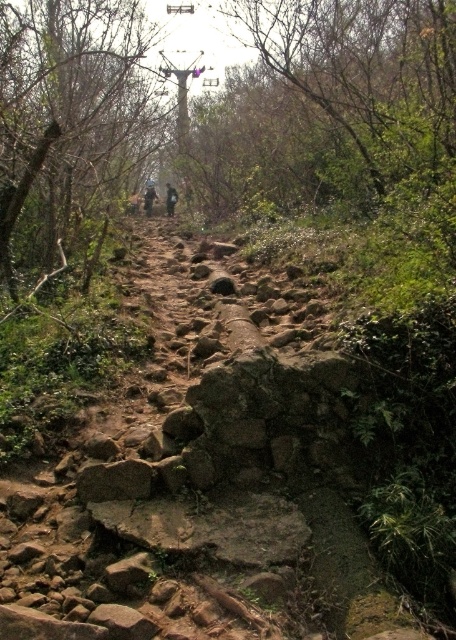
Question: Which point is closer to the camera?

Choices:
 (A) (171, 188)
 (B) (52, 225)
 (C) (145, 209)

Answer: (B)

Question: Is brown rough tree at upper left bigger than dark brown leather backpack at center?

Choices:
 (A) yes
 (B) no

Answer: (A)

Question: Among these points, which one is nearest to the camera?

Choices:
 (A) (93, 163)
 (B) (153, 189)

Answer: (A)

Question: Does brown rough tree at upper left appear over dark gray fabric jacket at center?

Choices:
 (A) yes
 (B) no

Answer: (A)

Question: Does dark gray fabric jacket at center have a smaller size compared to dark brown leather backpack at center?

Choices:
 (A) no
 (B) yes

Answer: (A)

Question: Which point appears farthest from the camera in this image?

Choices:
 (A) (148, 211)
 (B) (166, 195)
 (C) (13, 256)

Answer: (B)